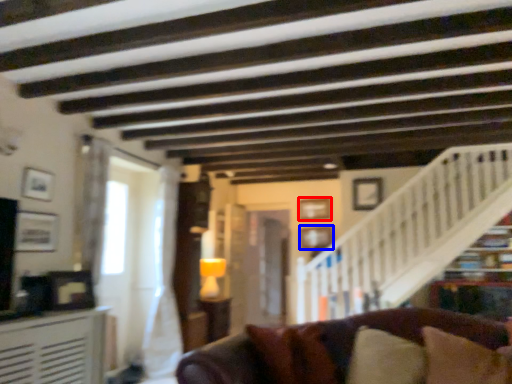
Question: Which object appears closest to the camera in this image, picture frame (highlighted by a red box) or picture frame (highlighted by a blue box)?

Choices:
 (A) picture frame
 (B) picture frame

Answer: (B)